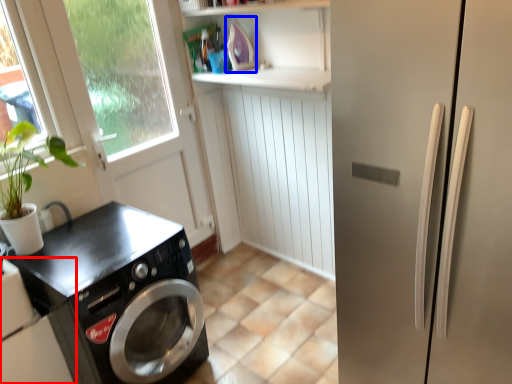
Question: Which point is closer to the camera, home appliance (highlighted by a red box) or appliance (highlighted by a blue box)?

Choices:
 (A) home appliance
 (B) appliance

Answer: (A)